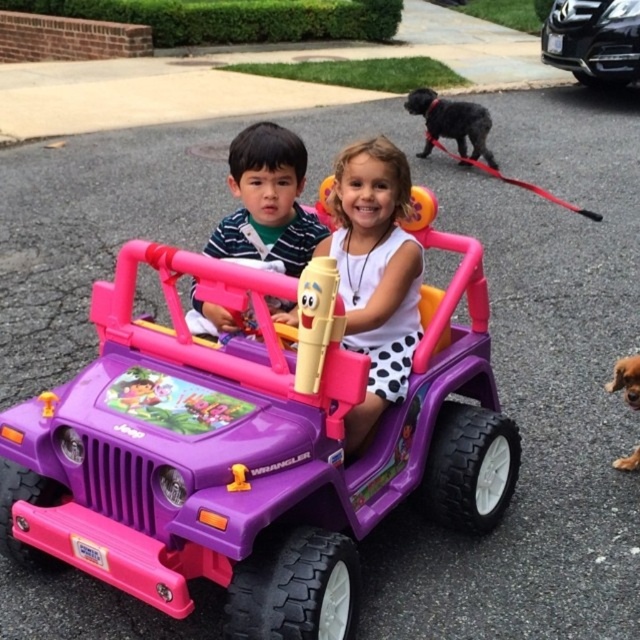
Who is positioned more to the right, purple plastic toy car at center or black glossy sedan at upper right?

From the viewer's perspective, black glossy sedan at upper right appears more on the right side.

Does purple plastic toy car at center appear over black glossy sedan at upper right?

Incorrect, purple plastic toy car at center is not positioned above black glossy sedan at upper right.

The height and width of the screenshot is (640, 640). Identify the location of purple plastic toy car at center. (248, 449).

Which is more to the left, purple plastic toy car at center or brown furry dog at lower right?

From the viewer's perspective, purple plastic toy car at center appears more on the left side.

In the scene shown: Which is below, purple plastic toy car at center or brown furry dog at lower right?

purple plastic toy car at center is below.

Locate an element on the screen. Image resolution: width=640 pixels, height=640 pixels. purple plastic toy car at center is located at coordinates (248, 449).

Can you confirm if white matte dress at center is positioned to the left of black glossy sedan at upper right?

Indeed, white matte dress at center is positioned on the left side of black glossy sedan at upper right.

Find the location of a particular element. white matte dress at center is located at coordinates (376, 273).